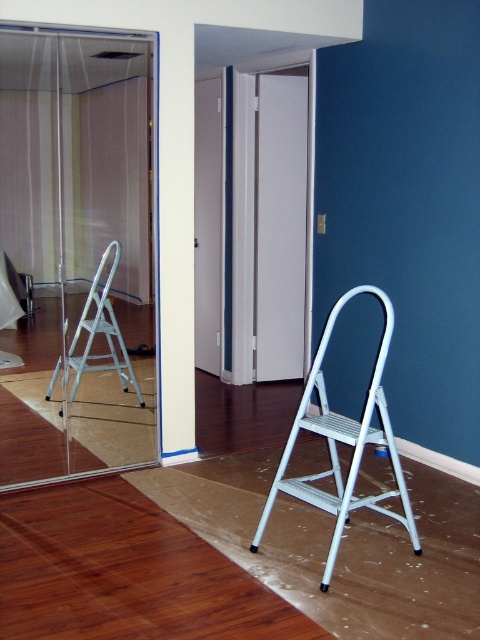
You are a painter working in this room. You need to reach a high spot on the wall near the transparent glass door at upper left and the silver metallic step ladder at left. Which object should you use to safely reach the area?

You should use the silver metallic step ladder at left because the transparent glass door at upper left is closer to the viewer, meaning the ladder is positioned further away and may not be the best choice for reaching the high spot safely.

You are standing in the room and want to move from the point at coordinates point (2, 426) to the point at coordinates point (363, 438). Can you walk directly between them without any obstacles?

Point (2, 426) is behind point (363, 438), so you cannot walk directly between them without going around the obstacle in front.

Looking at this image, you are a painter standing at the entrance of the room. You need to place a protective mat exactly where the brown wood flooring at lower center is located. According to the coordinates provided, where should you place the mat?

The protective mat should be placed at the coordinates (124, 572) where the brown wood flooring at lower center is located.